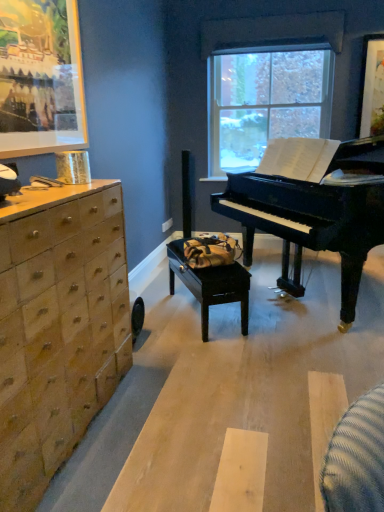
Question: Considering their positions, is black wood table at center located in front of or behind clear glass window at center?

Choices:
 (A) front
 (B) behind

Answer: (A)

Question: In terms of width, does black wood table at center look wider or thinner when compared to clear glass window at center?

Choices:
 (A) wide
 (B) thin

Answer: (A)

Question: Which of these objects is positioned closest to the black polished piano at center?

Choices:
 (A) wooden chest of drawers at left
 (B) clear glass window at center
 (C) black wood table at center

Answer: (C)

Question: Estimate the real-world distances between objects in this image. Which object is closer to the black wood table at center?

Choices:
 (A) clear glass window at center
 (B) black polished piano at center
 (C) wooden chest of drawers at left

Answer: (B)